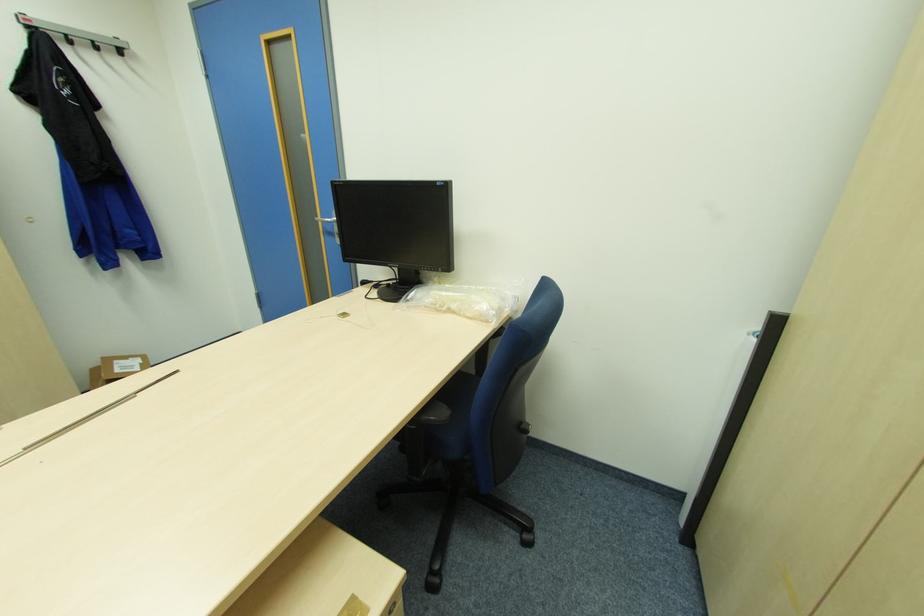
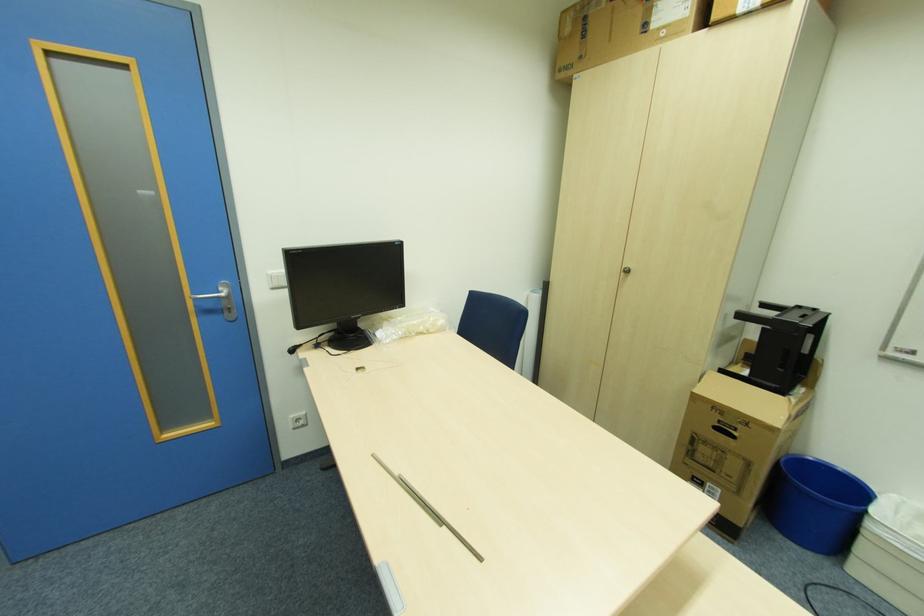
Where in the second image is the point corresponding to point (456, 306) from the first image?

(424, 329)